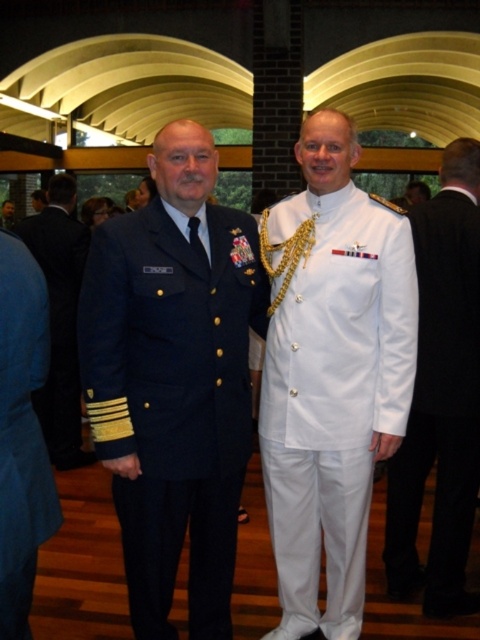
You are a military photographer tasked with capturing a group photo of the white glossy uniform at center and the dark blue uniform at left. Based on their heights, which uniform should be placed in the front row to ensure both are visible?

The white glossy uniform at center is shorter than the dark blue uniform at left, so placing the white glossy uniform at center in the front row will ensure both are visible.

You are a photographer standing 5 feet away from the two people in the image. You want to take a group photo of the white glossy uniform at center and the white glossy uniform at right. Can you fit both of them in the frame if your camera has a 20 inch wide field of view?

The distance between the white glossy uniform at center and the white glossy uniform at right is 17.50 inches. Since your camera has a 20 inch wide field of view, which is wider than the 17.50 inches separating them, you can fit both in the frame.